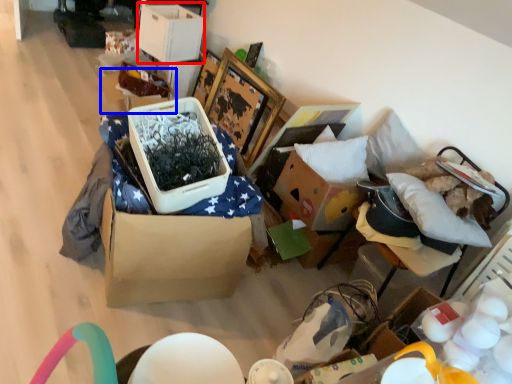
Question: Which object is further to the camera taking this photo, storage box (highlighted by a red box) or storage box (highlighted by a blue box)?

Choices:
 (A) storage box
 (B) storage box

Answer: (B)